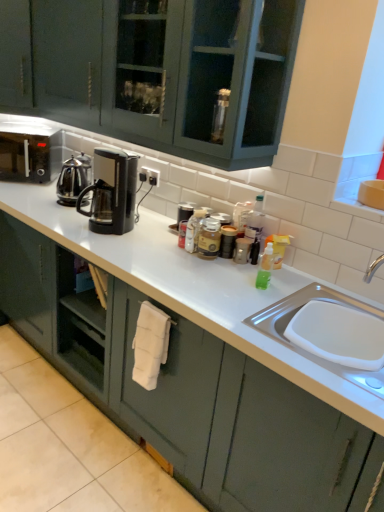
Consider the image. In order to face black plastic coffee maker at center, the first kitchen appliance viewed from the right, should I rotate leftwards or rightwards?

You should look left and rotate roughly 10.514 degrees.

Image resolution: width=384 pixels, height=512 pixels. What do you see at coordinates (111, 192) in the screenshot?
I see `black plastic coffee maker at center, the first kitchen appliance viewed from the right` at bounding box center [111, 192].

Measure the distance between metallic silver canister at center, marked as the second appliance in a back-to-front arrangement, and camera.

They are 6.00 feet apart.

In order to click on black plastic coffee maker at center, which ranks as the first kitchen appliance in front-to-back order in this screenshot , I will do `click(111, 192)`.

Which is closer to the camera, (21, 126) or (187, 208)?

Clearly, point (21, 126) is more distant from the camera than point (187, 208).

Who is taller, black matte microwave at left or metallic silver canister at center, which appears as the second appliance when viewed from the right?

With more height is black matte microwave at left.

From the image's perspective, which is above, black matte microwave at left or metallic silver canister at center, the second appliance positioned from the bottom?

black matte microwave at left is shown above in the image.

Can you confirm if black matte microwave at left is positioned to the right of metallic silver canister at center, which appears as the second appliance when viewed from the right?

In fact, black matte microwave at left is to the left of metallic silver canister at center, which appears as the second appliance when viewed from the right.

In the scene shown: Would you say matte green cabinet at center is part of metallic silver canister at center, which appears as the 2th appliance when viewed from the left,'s contents?

No, matte green cabinet at center is located outside of metallic silver canister at center, which appears as the 2th appliance when viewed from the left.

At what (x,y) coordinates should I click in order to perform the action: click on appliance that is the 1st object located above the matte green cabinet at center (from the image's perspective). Please return your answer as a coordinate pair (x, y). Looking at the image, I should click on (242, 250).

Considering the sizes of objects metallic silver canister at center, the first appliance positioned from the right, and matte green cabinet at center in the image provided, who is shorter, metallic silver canister at center, the first appliance positioned from the right, or matte green cabinet at center?

With less height is metallic silver canister at center, the first appliance positioned from the right.

Considering the positions of point (240, 241) and point (225, 365), is point (240, 241) closer or farther from the camera than point (225, 365)?

Point (240, 241) appears to be farther away from the viewer than point (225, 365).

Locate an element on the screen. appliance lying on the left of metallic silver canister at center, placed as the first appliance when sorted from front to back is located at coordinates (184, 212).

From the image's perspective, is metallic silver canister at center, which appears as the second appliance when viewed from the right, under metallic silver canister at center, the 2th appliance in the top-to-bottom sequence?

Actually, metallic silver canister at center, which appears as the second appliance when viewed from the right, appears above metallic silver canister at center, the 2th appliance in the top-to-bottom sequence, in the image.

From the picture: Is metallic silver canister at center, which is the 2th appliance in front-to-back order, next to metallic silver canister at center, which appears as the first appliance when ordered from the bottom, and touching it?

metallic silver canister at center, which is the 2th appliance in front-to-back order, and metallic silver canister at center, which appears as the first appliance when ordered from the bottom, are clearly separated.

Considering the sizes of objects metallic silver canister at center, which is the first appliance from back to front, and black plastic coffee maker at center, which ranks as the 2th kitchen appliance in left-to-right order, in the image provided, who is smaller, metallic silver canister at center, which is the first appliance from back to front, or black plastic coffee maker at center, which ranks as the 2th kitchen appliance in left-to-right order,?

Smaller between the two is metallic silver canister at center, which is the first appliance from back to front.

Could you measure the distance between metallic silver canister at center, which is the first appliance from left to right, and black plastic coffee maker at center, which is the 2th kitchen appliance from back to front?

The distance of metallic silver canister at center, which is the first appliance from left to right, from black plastic coffee maker at center, which is the 2th kitchen appliance from back to front, is 13.32 inches.

The height and width of the screenshot is (512, 384). In order to click on the 1st appliance directly beneath the black plastic coffee maker at center, which is the 2th kitchen appliance from back to front (from a real-world perspective) in this screenshot , I will do 184,212.

How different are the orientations of metallic silver canister at center, the second appliance positioned from the bottom, and black plastic coffee maker at center, the first kitchen appliance viewed from the right, in degrees?

They differ by 2.55 degrees in their facing directions.

What's the angular difference between black plastic coffee maker at center, which is the 2th kitchen appliance from back to front, and white plastic sink at right's facing directions?

The facing directions of black plastic coffee maker at center, which is the 2th kitchen appliance from back to front, and white plastic sink at right are 0.756 degrees apart.

From the picture: Which is closer, (x=107, y=151) or (x=361, y=387)?

Clearly, point (x=107, y=151) is more distant from the camera than point (x=361, y=387).

Can you confirm if black plastic coffee maker at center, which ranks as the 2th kitchen appliance in left-to-right order, is wider than white plastic sink at right?

In fact, black plastic coffee maker at center, which ranks as the 2th kitchen appliance in left-to-right order, might be narrower than white plastic sink at right.

Is black plastic coffee maker at center, which ranks as the first kitchen appliance in front-to-back order, facing towards white plastic sink at right?

No, black plastic coffee maker at center, which ranks as the first kitchen appliance in front-to-back order, is not oriented towards white plastic sink at right.

Does white plastic sink at right touch black matte microwave at left?

They are not placed beside each other.

From a real-world perspective, who is located lower, white plastic sink at right or black matte microwave at left?

white plastic sink at right.

Consider the image. Considering the positions of objects white plastic sink at right and black matte microwave at left in the image provided, who is more to the left, white plastic sink at right or black matte microwave at left?

black matte microwave at left.

The width and height of the screenshot is (384, 512). I want to click on sink below the black matte microwave at left (from the image's perspective), so click(x=307, y=351).

Do you think metallic silver canister at center, the second appliance positioned from the bottom, is within matte green cabinet at center, or outside of it?

metallic silver canister at center, the second appliance positioned from the bottom, is not enclosed by matte green cabinet at center.

Is metallic silver canister at center, which appears as the second appliance when viewed from the right, positioned with its back to matte green cabinet at center?

metallic silver canister at center, which appears as the second appliance when viewed from the right, is not turned away from matte green cabinet at center.

Which of these two, metallic silver canister at center, which is the first appliance from left to right, or matte green cabinet at center, is thinner?

Thinner between the two is metallic silver canister at center, which is the first appliance from left to right.

Locate an element on the screen. This screenshot has width=384, height=512. the 1st appliance in front of the black matte microwave at left, counting from the anchor's position is located at coordinates (184, 212).

You are a GUI agent. You are given a task and a screenshot of the screen. Output one action in this format:
    pyautogui.click(x=<x>, y=<y>)
    Task: Click on the cabinetry located on the right of metallic silver canister at center, marked as the second appliance in a back-to-front arrangement
    This screenshot has width=384, height=512.
    Given the screenshot: What is the action you would take?
    pyautogui.click(x=188, y=392)

When comparing their distances from black matte microwave at left, does white plastic sink at right or matte green cabinet at center seem further?

Based on the image, white plastic sink at right appears to be further to black matte microwave at left.

Which object lies nearer to the anchor point black plastic coffee maker at center, which ranks as the first kitchen appliance in front-to-back order, metallic silver canister at center, the second appliance positioned from the bottom, or white plastic sink at right?

Based on the image, metallic silver canister at center, the second appliance positioned from the bottom, appears to be nearer to black plastic coffee maker at center, which ranks as the first kitchen appliance in front-to-back order.

Which object lies further to the anchor point black plastic coffee maker at center, the first kitchen appliance viewed from the right, metallic silver canister at center, which is the 2th appliance in front-to-back order, or polished stainless steel kettle at left, the 2th kitchen appliance positioned from the right?

metallic silver canister at center, which is the 2th appliance in front-to-back order, is further to black plastic coffee maker at center, the first kitchen appliance viewed from the right.

Based on their spatial positions, is matte green cabinet at center or polished stainless steel kettle at left, the first kitchen appliance viewed from the back, further from metallic silver canister at center, which is the 2th appliance in front-to-back order?

matte green cabinet at center lies further to metallic silver canister at center, which is the 2th appliance in front-to-back order, than the other object.

Which object lies further to the anchor point black matte microwave at left, metallic silver canister at center, which is the first appliance from left to right, or white plastic sink at right?

The object further to black matte microwave at left is white plastic sink at right.

Looking at this image, looking at the image, which one is located closer to matte green cabinet at center, metallic silver canister at center, the 2th appliance in the top-to-bottom sequence, or white plastic sink at right?

white plastic sink at right is closer to matte green cabinet at center.

Based on their spatial positions, is metallic silver canister at center, which appears as the first appliance when ordered from the bottom, or metallic silver canister at center, which is the first appliance from back to front, closer to black plastic coffee maker at center, which ranks as the 2th kitchen appliance in left-to-right order?

Based on the image, metallic silver canister at center, which is the first appliance from back to front, appears to be nearer to black plastic coffee maker at center, which ranks as the 2th kitchen appliance in left-to-right order.

Based on their spatial positions, is matte green cabinet at center or black matte microwave at left closer to metallic silver canister at center, which is the 2th appliance in front-to-back order?

matte green cabinet at center lies closer to metallic silver canister at center, which is the 2th appliance in front-to-back order, than the other object.

The height and width of the screenshot is (512, 384). I want to click on kitchen appliance between white plastic sink at right and metallic silver canister at center, acting as the first appliance starting from the top, from front to back, so click(111, 192).

What are the coordinates of `cabinetry situated between black matte microwave at left and white plastic sink at right from left to right` in the screenshot? It's located at (188, 392).

Image resolution: width=384 pixels, height=512 pixels. I want to click on sink positioned between matte green cabinet at center and metallic silver canister at center, which appears as the second appliance when viewed from the right, from near to far, so click(307, 351).

In order to click on kitchen appliance between polished stainless steel kettle at left, the first kitchen appliance viewed from the left, and metallic silver canister at center, which is the first appliance from left to right, from left to right in this screenshot , I will do `click(111, 192)`.